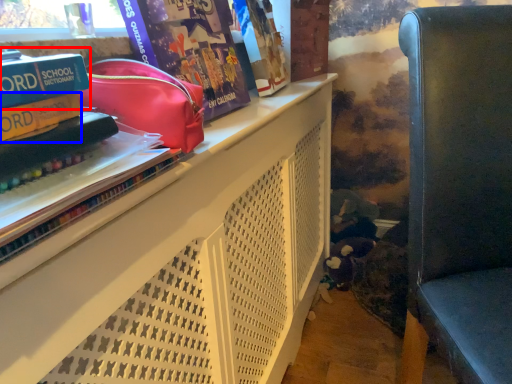
Question: Which point is further to the camera, paperback book (highlighted by a red box) or paperback book (highlighted by a blue box)?

Choices:
 (A) paperback book
 (B) paperback book

Answer: (B)